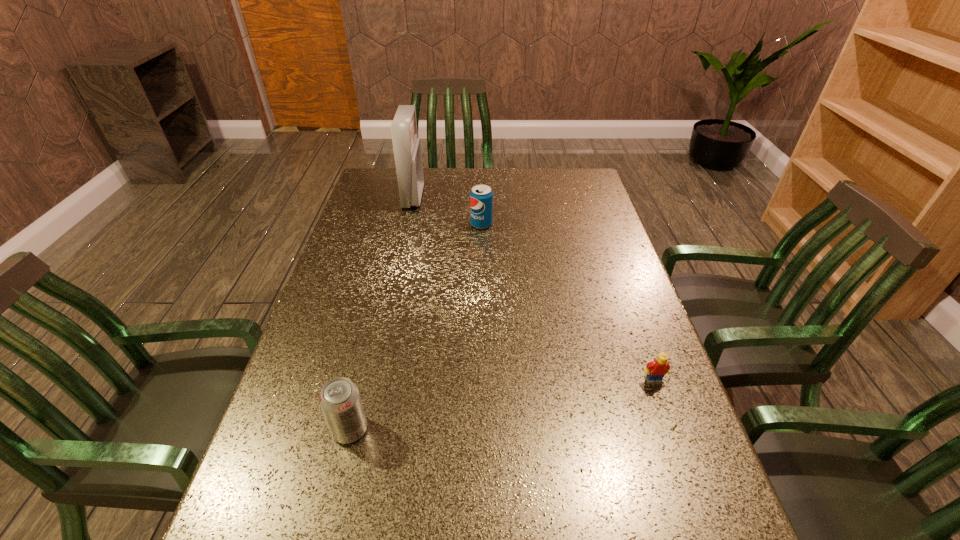
Identify the location of vacant region at the far right corner of the desktop. This screenshot has height=540, width=960. (579, 183).

The height and width of the screenshot is (540, 960). I want to click on free space between the second nearest object and the farthest object, so tap(534, 288).

This screenshot has width=960, height=540. I want to click on free space between the third nearest object and the nearest object, so click(416, 327).

Find the location of a particular element. The width and height of the screenshot is (960, 540). vacant area that lies between the third farthest object and the left soda can is located at coordinates (502, 405).

Image resolution: width=960 pixels, height=540 pixels. Identify the location of vacant area between the rightmost object and the first-aid kit. (534, 288).

Where is `vacant area that lies between the second object from right to left and the farthest object`? This screenshot has height=540, width=960. vacant area that lies between the second object from right to left and the farthest object is located at coordinates (447, 211).

The width and height of the screenshot is (960, 540). Identify the location of free space between the farther soda can and the tallest object. (447, 211).

You are a GUI agent. You are given a task and a screenshot of the screen. Output one action in this format:
    pyautogui.click(x=<x>, y=<y>)
    Task: Click on the free spot between the second nearest object and the nearer soda can
    The image size is (960, 540).
    Given the screenshot: What is the action you would take?
    pyautogui.click(x=502, y=405)

Locate an element on the screen. Image resolution: width=960 pixels, height=540 pixels. empty location between the left soda can and the tallest object is located at coordinates (382, 313).

Where is `free area in between the Lego and the tallest object`? This screenshot has height=540, width=960. free area in between the Lego and the tallest object is located at coordinates point(534,288).